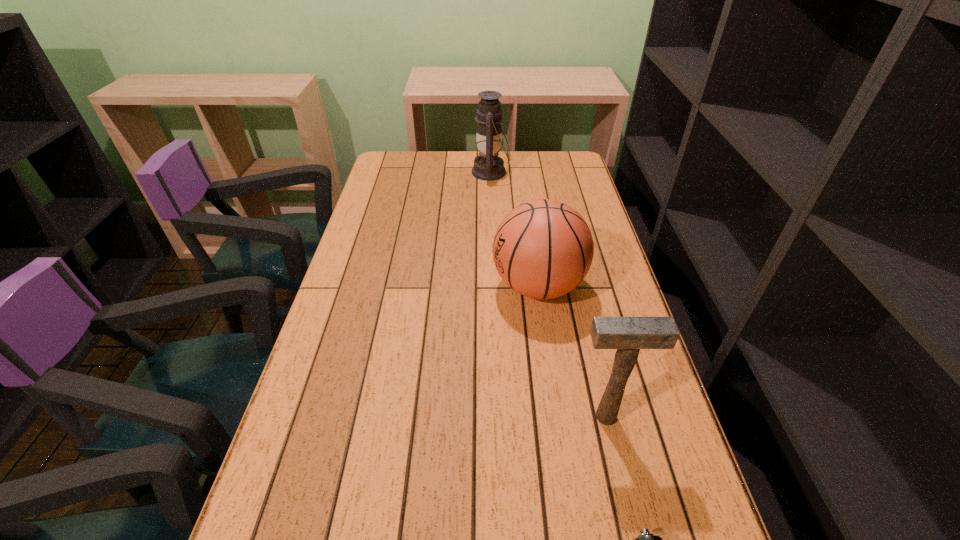
You are a GUI agent. You are given a task and a screenshot of the screen. Output one action in this format:
    pyautogui.click(x=<x>, y=<y>)
    Task: Click on the basketball that is positioned at the right edge
    The width and height of the screenshot is (960, 540).
    Given the screenshot: What is the action you would take?
    pyautogui.click(x=542, y=249)

I want to click on vacant space at the far edge of the desktop, so click(x=442, y=178).

In the image, there is a desktop. At what (x,y) coordinates should I click in order to perform the action: click on vacant space at the left edge. Please return your answer as a coordinate pair (x, y). Looking at the image, I should click on (303, 410).

What are the coordinates of `vacant position at the right edge of the desktop` in the screenshot? It's located at (614, 314).

I want to click on unoccupied area between the second nearest object and the second farthest object, so pos(572,351).

Where is `object that is the closest to the third farthest object`? The width and height of the screenshot is (960, 540). object that is the closest to the third farthest object is located at coordinates (646, 539).

Locate an element on the screen. The height and width of the screenshot is (540, 960). object that is the closest to the second nearest object is located at coordinates (646, 539).

Where is `free space that satisfies the following two spatial constraints: 1. on the surface of the mallet near the brand logo; 2. on the right side of the basketball`? free space that satisfies the following two spatial constraints: 1. on the surface of the mallet near the brand logo; 2. on the right side of the basketball is located at coordinates (557, 416).

Image resolution: width=960 pixels, height=540 pixels. Identify the location of vacant space that satisfies the following two spatial constraints: 1. on the surface of the second nearest object near the brand logo; 2. on the left side of the basketball. (557, 416).